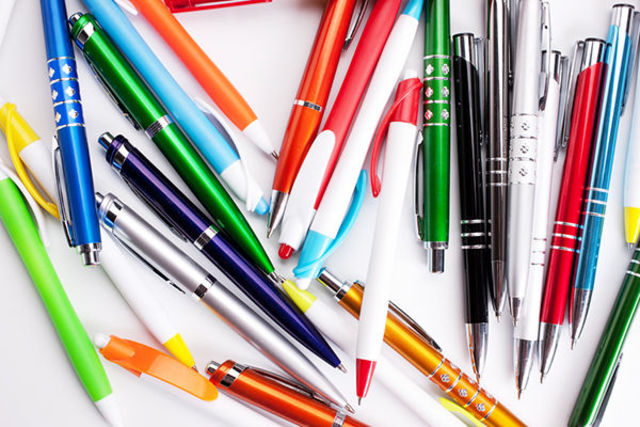
You are a GUI agent. You are given a task and a screenshot of the screen. Output one action in this format:
    pyautogui.click(x=<x>, y=<y>)
    Task: Click on the pens with silver tip
    
    Given the screenshot: What is the action you would take?
    pyautogui.click(x=580, y=304), pyautogui.click(x=550, y=335), pyautogui.click(x=525, y=348), pyautogui.click(x=515, y=303), pyautogui.click(x=493, y=280), pyautogui.click(x=468, y=350), pyautogui.click(x=275, y=205), pyautogui.click(x=329, y=390)